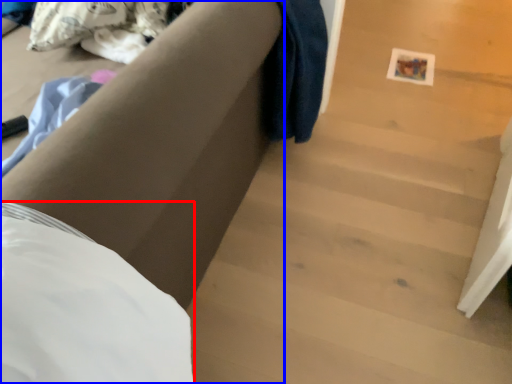
Question: Which object is further to the camera taking this photo, sheet (highlighted by a red box) or furniture (highlighted by a blue box)?

Choices:
 (A) sheet
 (B) furniture

Answer: (B)